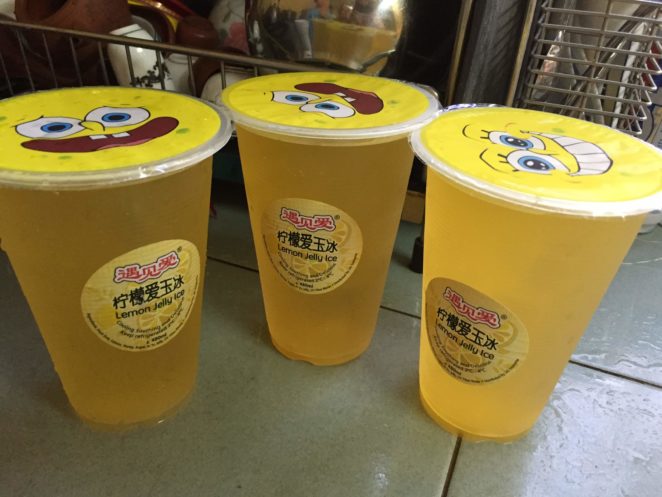
The image size is (662, 497). Find the location of `tiles`. tiles is located at coordinates (336, 428), (389, 290), (638, 305), (596, 438).